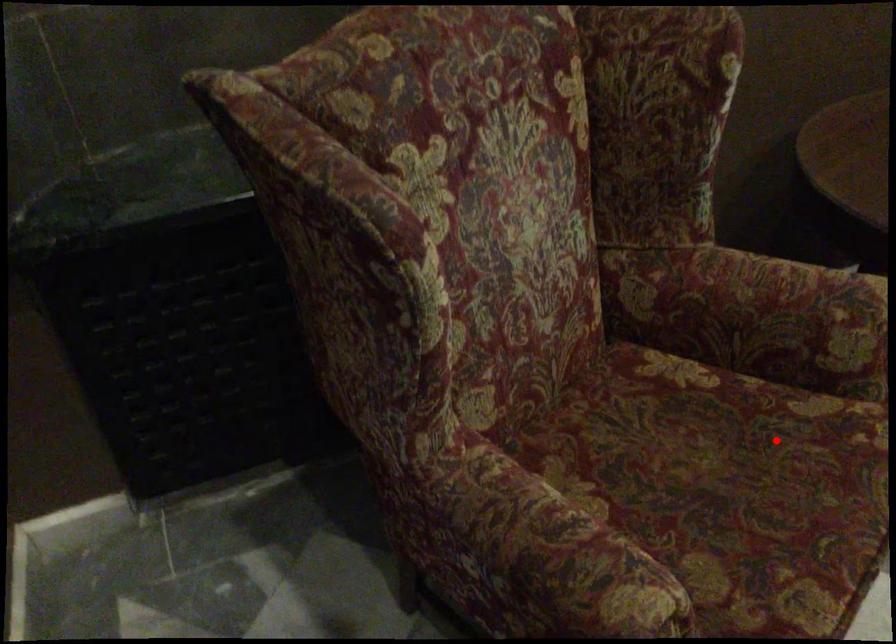
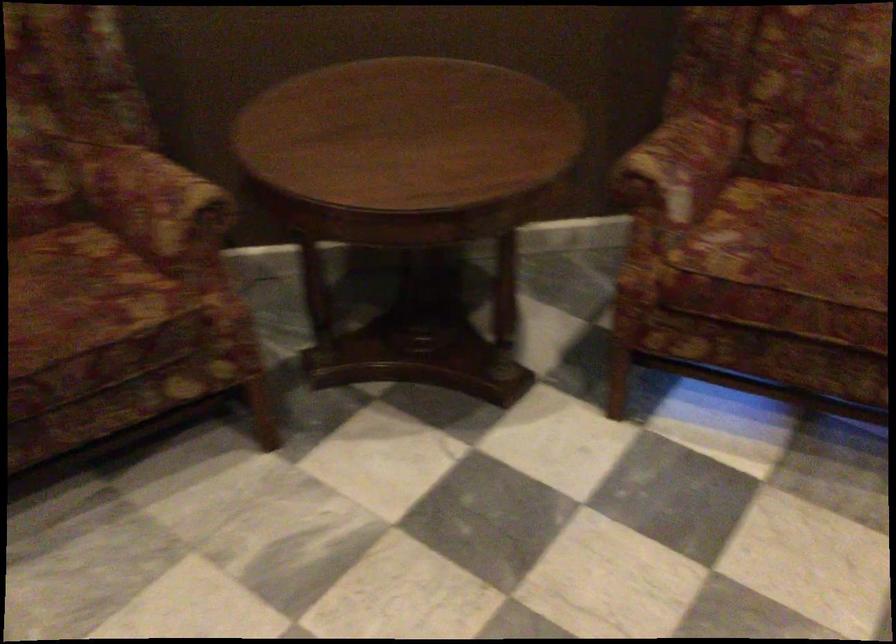
Locate, in the second image, the point that corresponds to the highlighted location in the first image.

(80, 292)